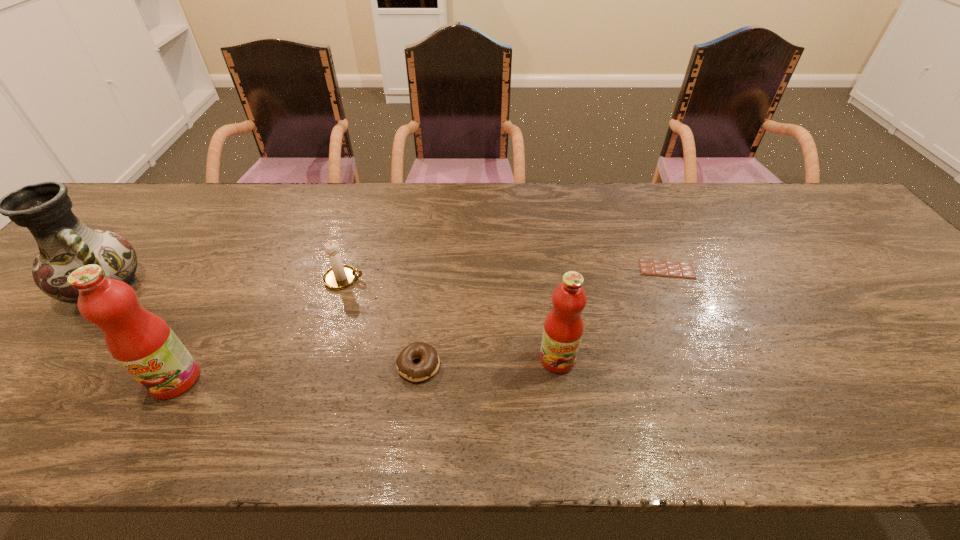
Image resolution: width=960 pixels, height=540 pixels. In order to click on free space that is in between the right fruit juice and the leftmost object in this screenshot , I will do `click(332, 323)`.

The image size is (960, 540). What are the coordinates of `vacant region between the shorter fruit juice and the taller fruit juice` in the screenshot? It's located at (366, 369).

You are a GUI agent. You are given a task and a screenshot of the screen. Output one action in this format:
    pyautogui.click(x=<x>, y=<y>)
    Task: Click on the vacant area between the shortest object and the third shortest object
    This screenshot has height=540, width=960.
    Given the screenshot: What is the action you would take?
    pyautogui.click(x=505, y=274)

Where is `empty location between the doughnut and the candle holder`? This screenshot has width=960, height=540. empty location between the doughnut and the candle holder is located at coordinates (381, 322).

You are a GUI agent. You are given a task and a screenshot of the screen. Output one action in this format:
    pyautogui.click(x=<x>, y=<y>)
    Task: Click on the vacant space that is in between the third object from right to left and the vase
    
    Given the screenshot: What is the action you would take?
    pyautogui.click(x=263, y=326)

This screenshot has height=540, width=960. I want to click on free space that is in between the shorter fruit juice and the doughnut, so click(x=488, y=362).

At what (x,y) coordinates should I click in order to perform the action: click on free space that is in between the rightmost object and the shorter fruit juice. Please return your answer as a coordinate pair (x, y). The width and height of the screenshot is (960, 540). Looking at the image, I should click on (612, 314).

Locate an element on the screen. vacant space that's between the fourth tallest object and the fifth object from right to left is located at coordinates (259, 329).

This screenshot has height=540, width=960. Find the location of `vacant point located between the fourth object from left to right and the fifth object from left to right`. vacant point located between the fourth object from left to right and the fifth object from left to right is located at coordinates (488, 362).

Identify the location of vacant space that's between the third shortest object and the second shortest object. This screenshot has height=540, width=960. (381, 322).